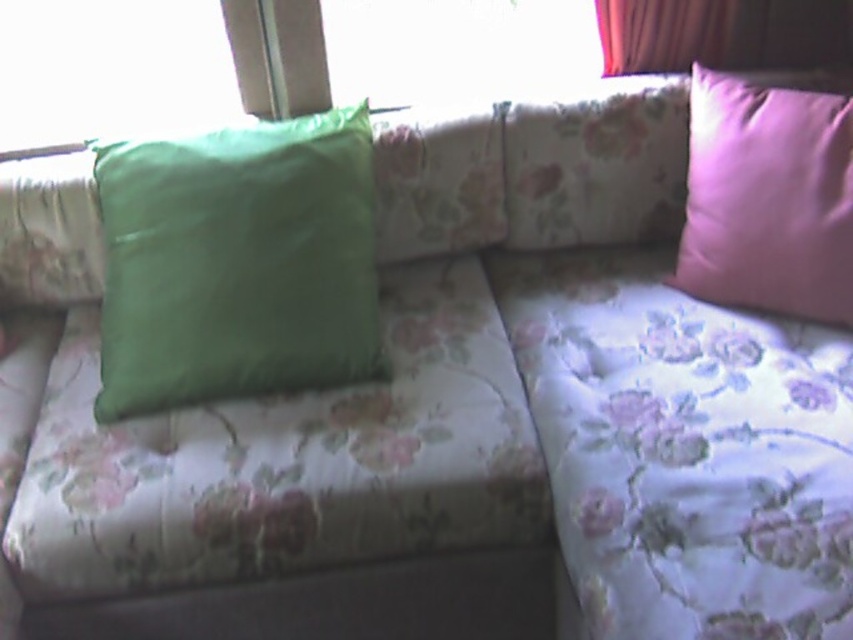
Question: Which of the following is the farthest from the observer?

Choices:
 (A) (448, 54)
 (B) (164, 172)

Answer: (A)

Question: Does transparent glass window at upper center appear on the right side of velvet pink curtain at upper right?

Choices:
 (A) yes
 (B) no

Answer: (B)

Question: Based on their relative distances, which object is nearer to the velvet pink curtain at upper right?

Choices:
 (A) pink satin pillow at right
 (B) transparent glass window at upper center
 (C) green matte pillow at left
 (D) transparent glass window at upper left

Answer: (B)

Question: Can you confirm if green matte pillow at left is smaller than transparent glass window at upper center?

Choices:
 (A) no
 (B) yes

Answer: (A)

Question: Is transparent glass window at upper left positioned behind velvet pink curtain at upper right?

Choices:
 (A) no
 (B) yes

Answer: (A)

Question: Which object appears closest to the camera in this image?

Choices:
 (A) transparent glass window at upper left
 (B) pink satin pillow at right
 (C) velvet pink curtain at upper right
 (D) transparent glass window at upper center

Answer: (B)